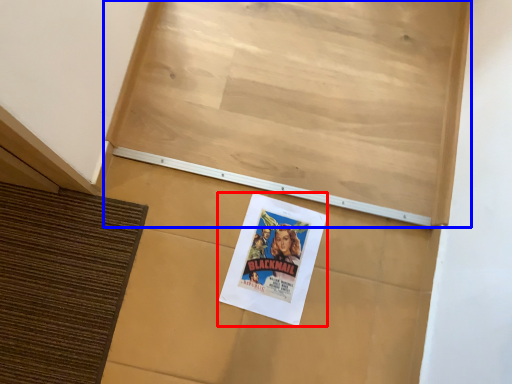
Question: Among these objects, which one is farthest to the camera, poster (highlighted by a red box) or bulletin board (highlighted by a blue box)?

Choices:
 (A) poster
 (B) bulletin board

Answer: (A)